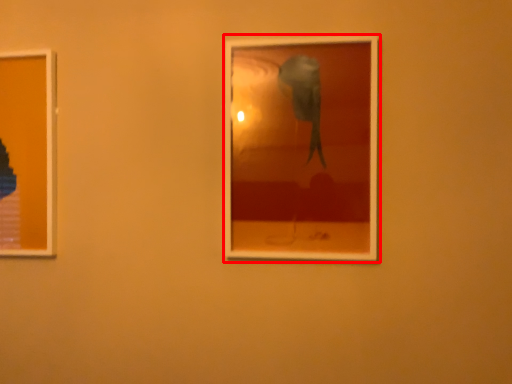
Question: From the image's perspective, considering the relative positions of picture frame (annotated by the red box) and picture frame in the image provided, where is picture frame (annotated by the red box) located with respect to the staircase?

Choices:
 (A) below
 (B) above

Answer: (B)